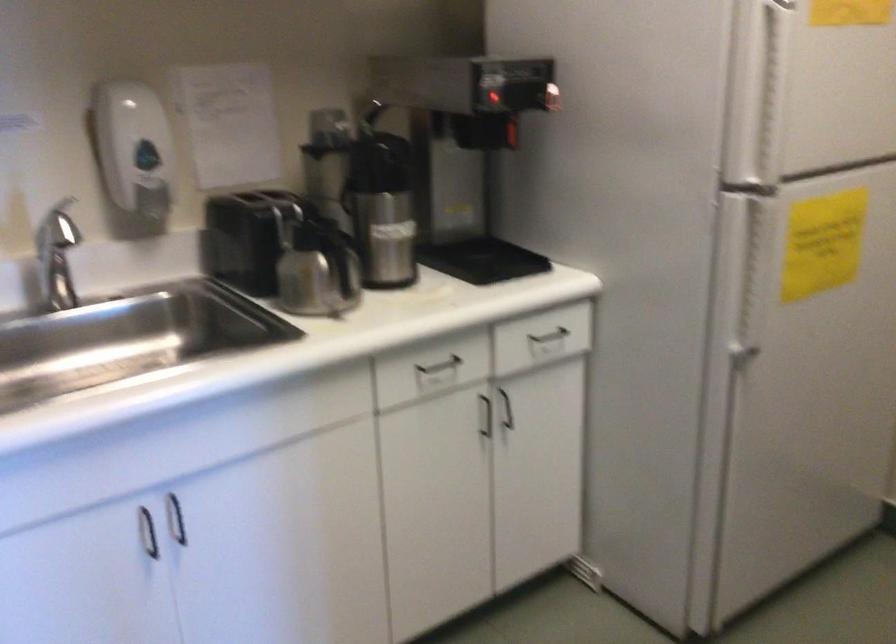
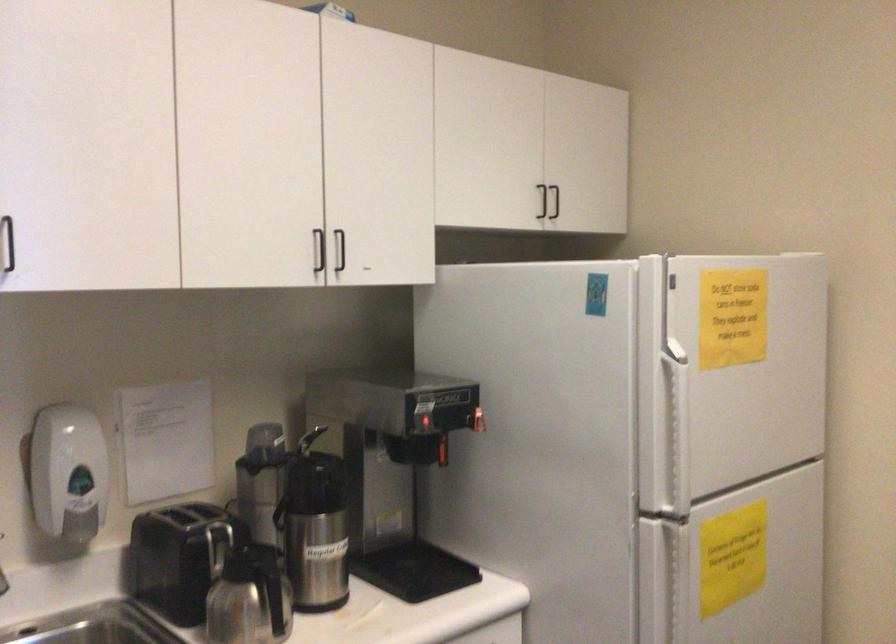
In the second image, find the point that corresponds to point 513,128 in the first image.

(442, 451)